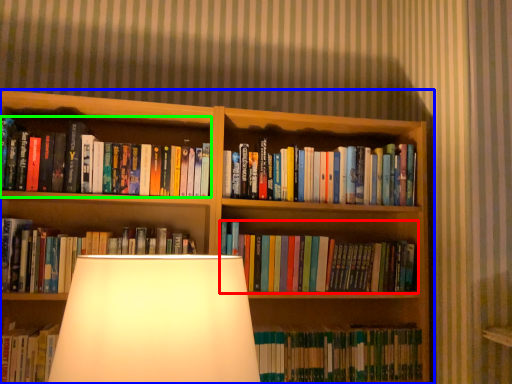
Question: Which is farther away from book (highlighted by a red box)? bookcase (highlighted by a blue box) or book (highlighted by a green box)?

Choices:
 (A) bookcase
 (B) book

Answer: (B)